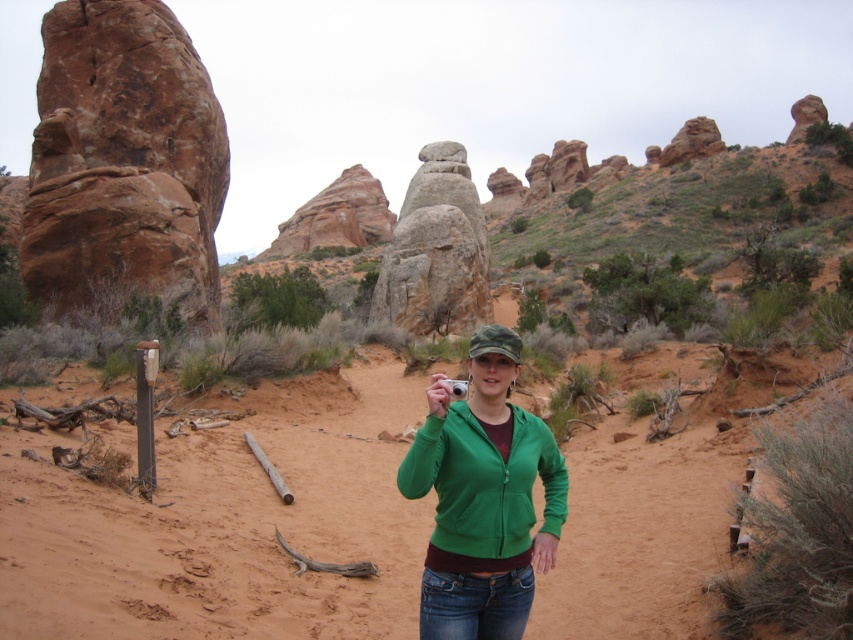
You are a photographer planning to capture the entire sandy brown at center and rustic stone formation at center in one frame. Given that your camera has a fixed field of view, which object should you position closer to the center of the frame to ensure both fit without cropping?

Since the sandy brown at center has a larger width than the rustic stone formation at center, you should position the sandy brown at center closer to the center of the frame to ensure both fit within the camera frame without cropping.

From the picture: You are a photographer standing on the sandy path in the desert scene. You want to capture a photo of the rustic sandstone rock formation at left. Given that your camera has a maximum focus range of 100 meters, will you be able to clearly capture the rock formation in your photo?

The rustic sandstone rock formation at left is 107.51 meters from the camera. Since the camera can only focus up to 100 meters, it will not be able to clearly capture the rock formation at that distance.